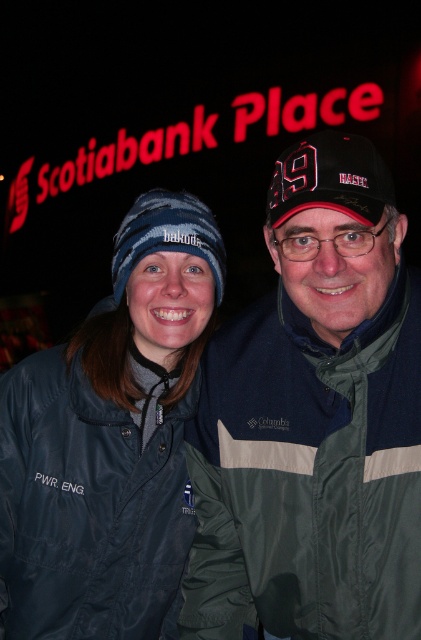
Which is behind, point (226, 636) or point (365, 141)?

The point (226, 636) is behind.

Between green nylon jacket at center and black fabric cap at center, which one is positioned lower?

green nylon jacket at center is below.

The width and height of the screenshot is (421, 640). Describe the element at coordinates (314, 420) in the screenshot. I see `green nylon jacket at center` at that location.

The image size is (421, 640). I want to click on green nylon jacket at center, so click(x=314, y=420).

Is dark blue nylon jacket at center shorter than black fabric cap at center?

Incorrect, dark blue nylon jacket at center's height does not fall short of black fabric cap at center's.

Can you confirm if dark blue nylon jacket at center is bigger than black fabric cap at center?

Yes, dark blue nylon jacket at center is bigger than black fabric cap at center.

Which is behind, point (23, 435) or point (311, 179)?

The point (23, 435) is more distant.

Identify the location of dark blue nylon jacket at center. (111, 440).

Can you confirm if green nylon jacket at center is positioned to the right of blue knit beanie at center?

Indeed, green nylon jacket at center is positioned on the right side of blue knit beanie at center.

Can you confirm if green nylon jacket at center is positioned to the left of blue knit beanie at center?

No, green nylon jacket at center is not to the left of blue knit beanie at center.

What are the coordinates of `green nylon jacket at center` in the screenshot? It's located at (314, 420).